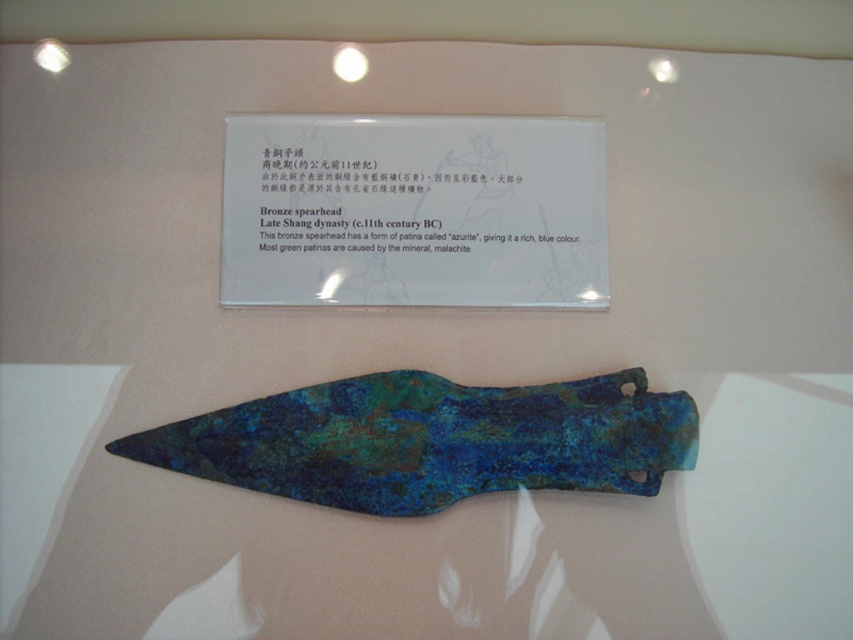
Question: Among these points, which one is nearest to the camera?

Choices:
 (A) (361, 150)
 (B) (341, 394)

Answer: (B)

Question: Does blue patina sign at upper center have a larger size compared to blue-green patina spearhead at center?

Choices:
 (A) no
 (B) yes

Answer: (A)

Question: Is blue patina sign at upper center positioned before blue-green patina spearhead at center?

Choices:
 (A) yes
 (B) no

Answer: (B)

Question: Which object appears closest to the camera in this image?

Choices:
 (A) blue-green patina spearhead at center
 (B) blue patina sign at upper center

Answer: (A)

Question: Is blue patina sign at upper center below blue-green patina spearhead at center?

Choices:
 (A) no
 (B) yes

Answer: (A)

Question: Among these points, which one is nearest to the camera?

Choices:
 (A) (494, 465)
 (B) (558, 280)

Answer: (A)